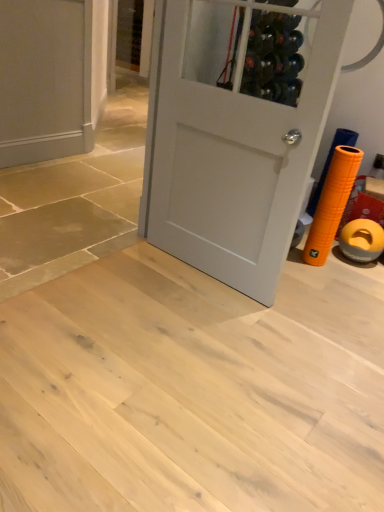
I want to click on vacant space in front of white matte door at center, which is the 1th door in front-to-back order, so click(x=206, y=328).